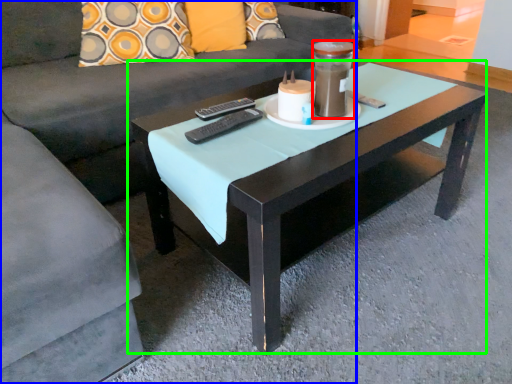
Question: Which object is the closest to the beverage (highlighted by a red box)? Choose among these: studio couch (highlighted by a blue box) or coffee table (highlighted by a green box).

Choices:
 (A) studio couch
 (B) coffee table

Answer: (B)